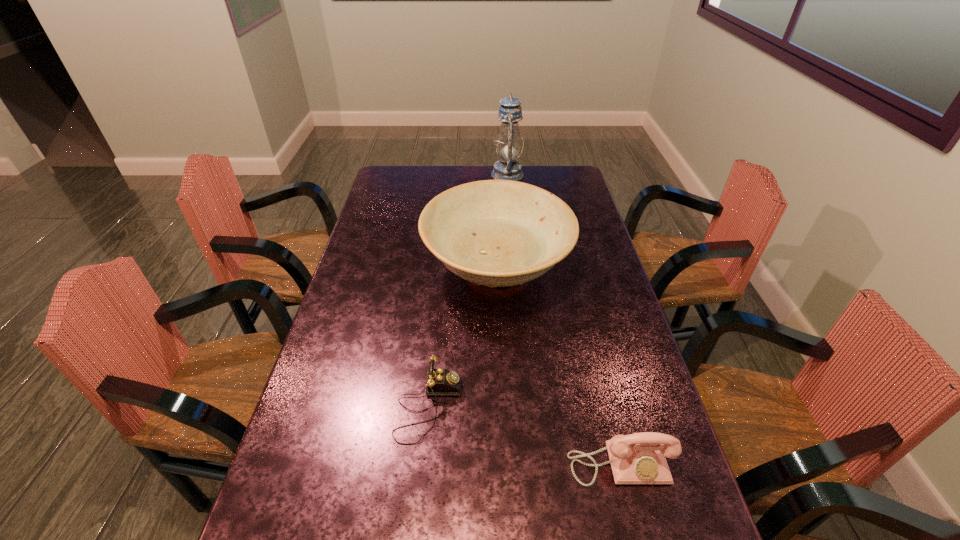
Find the location of a particular element. The height and width of the screenshot is (540, 960). the tallest object is located at coordinates (508, 145).

Locate an element on the screen. The image size is (960, 540). the farthest object is located at coordinates (508, 145).

At what (x,y) coordinates should I click in order to perform the action: click on the third shortest object. Please return your answer as a coordinate pair (x, y). Looking at the image, I should click on (498, 233).

Where is `dish`? dish is located at coordinates (498, 233).

Locate an element on the screen. the third tallest object is located at coordinates pos(639,458).

I want to click on the right telephone, so click(x=639, y=458).

Where is `the left telephone`? the left telephone is located at coordinates (440, 382).

Image resolution: width=960 pixels, height=540 pixels. In order to click on the shortest object in this screenshot , I will do `click(440, 382)`.

The width and height of the screenshot is (960, 540). Find the location of `free space located on the front-facing side of the lantern`. free space located on the front-facing side of the lantern is located at coordinates pos(451,174).

You are a GUI agent. You are given a task and a screenshot of the screen. Output one action in this format:
    pyautogui.click(x=<x>, y=<y>)
    Task: Click on the free spot located on the front-facing side of the lantern
    
    Given the screenshot: What is the action you would take?
    pyautogui.click(x=480, y=174)